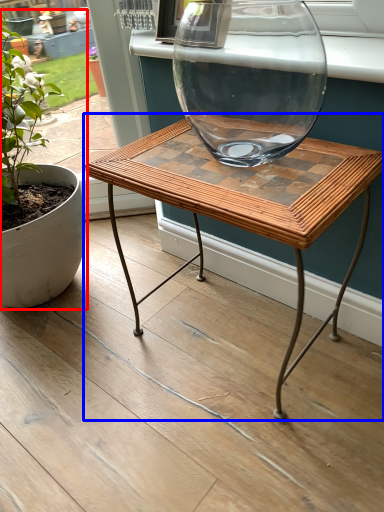
Question: Which object appears farthest to the camera in this image, houseplant (highlighted by a red box) or coffee table (highlighted by a blue box)?

Choices:
 (A) houseplant
 (B) coffee table

Answer: (A)